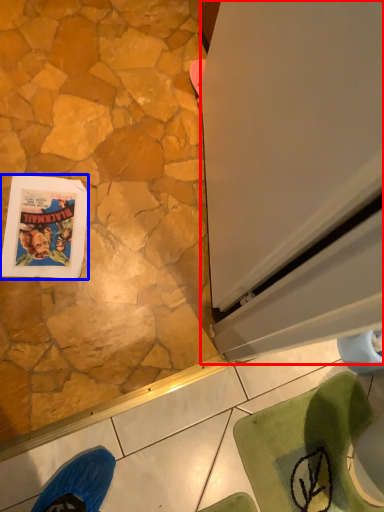
Question: Which object is closer to the camera taking this photo, screen door (highlighted by a red box) or comic book (highlighted by a blue box)?

Choices:
 (A) screen door
 (B) comic book

Answer: (A)